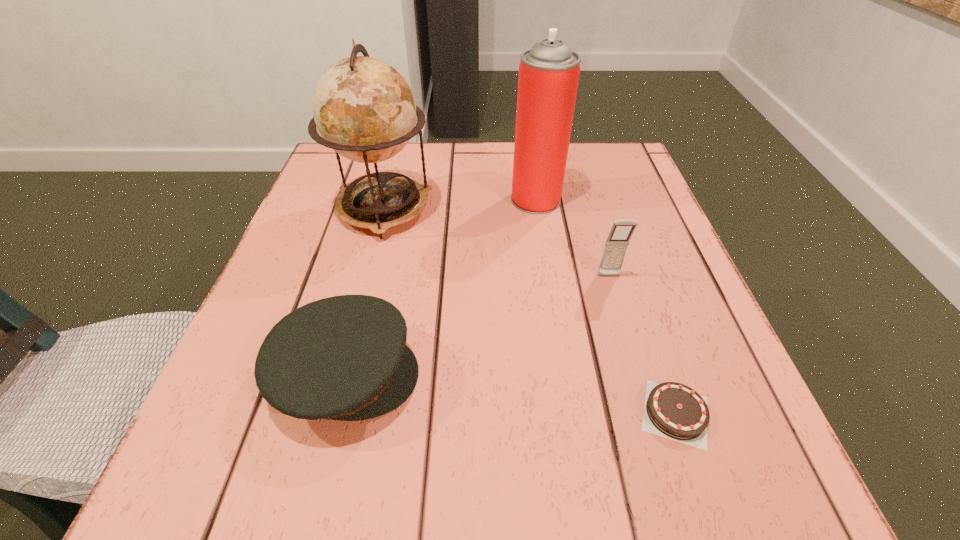
Identify the location of vacant space situated 0.290m on the left of the shortest object. The image size is (960, 540). (427, 413).

I want to click on aerosol can that is at the far edge, so tap(549, 72).

Locate an element on the screen. The height and width of the screenshot is (540, 960). globe located at the far edge is located at coordinates (365, 111).

Locate an element on the screen. The height and width of the screenshot is (540, 960). beret situated at the near edge is located at coordinates (345, 358).

Locate an element on the screen. The width and height of the screenshot is (960, 540). chocolate cake located at the near edge is located at coordinates (672, 410).

In order to click on globe that is at the left edge in this screenshot , I will do `click(365, 111)`.

This screenshot has height=540, width=960. Find the location of `beret located in the left edge section of the desktop`. beret located in the left edge section of the desktop is located at coordinates (345, 358).

This screenshot has width=960, height=540. I want to click on cellular telephone located in the right edge section of the desktop, so click(x=615, y=248).

This screenshot has width=960, height=540. I want to click on chocolate cake positioned at the right edge, so click(672, 410).

Locate an element on the screen. This screenshot has width=960, height=540. object located at the far left corner is located at coordinates (365, 111).